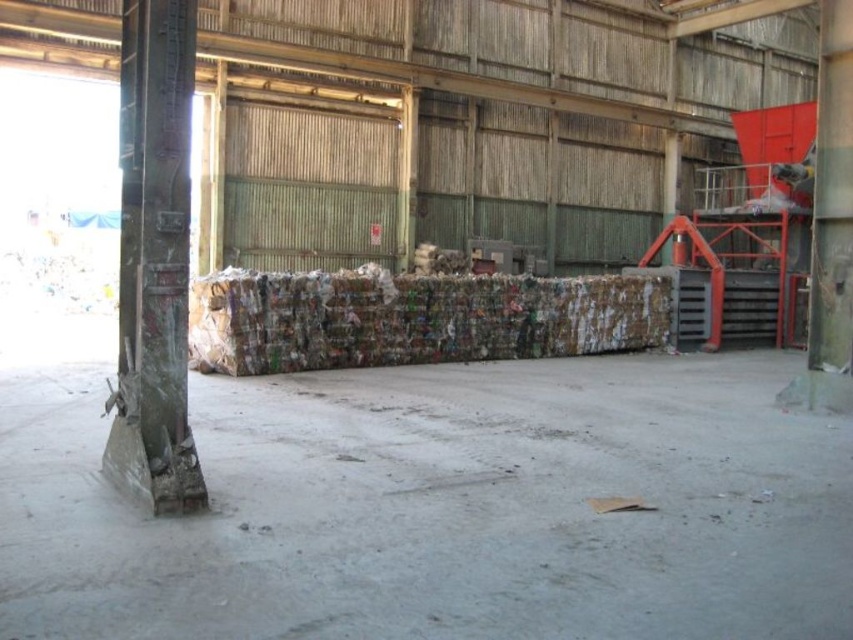
Is brown cardboard bales at center to the right of concrete textured pillar at left from the viewer's perspective?

Yes, brown cardboard bales at center is to the right of concrete textured pillar at left.

Is brown cardboard bales at center bigger than concrete textured pillar at left?

Yes, brown cardboard bales at center is bigger than concrete textured pillar at left.

Describe the element at coordinates (415, 317) in the screenshot. Image resolution: width=853 pixels, height=640 pixels. I see `brown cardboard bales at center` at that location.

Identify the location of brown cardboard bales at center. This screenshot has width=853, height=640. (415, 317).